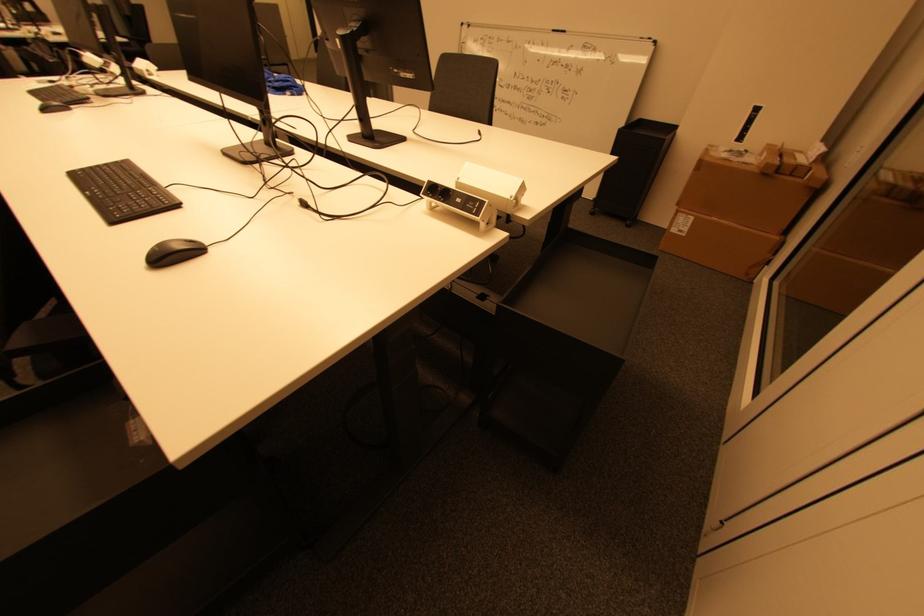
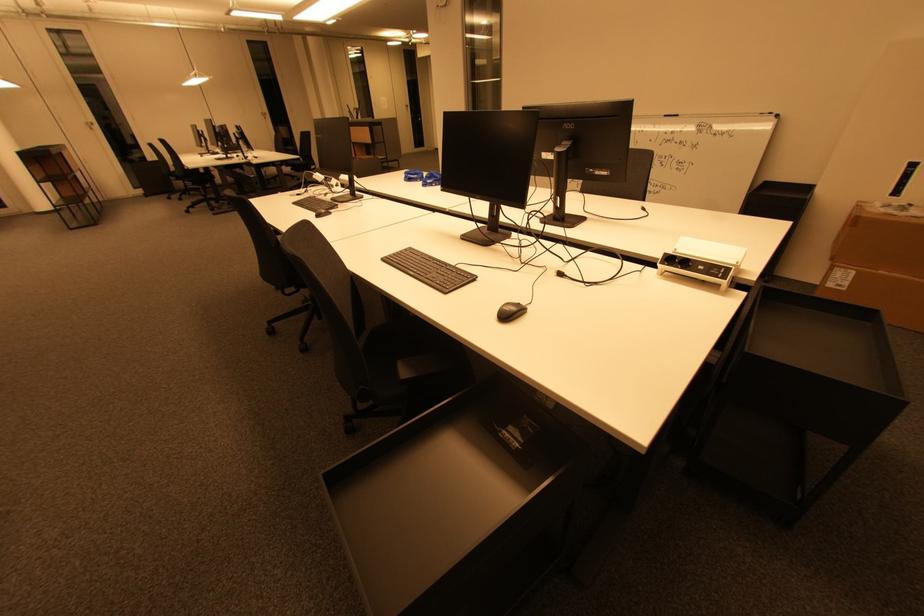
Question: The first image is from the beginning of the video and the second image is from the end. How did the camera likely rotate when shooting the video?

Choices:
 (A) Left
 (B) Right
 (C) Up
 (D) Down

Answer: (A)